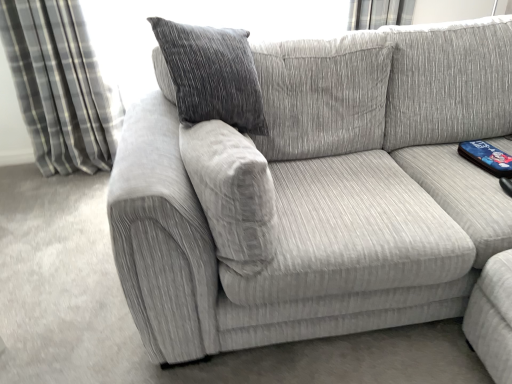
Question: Would you say gray plaid curtain at left contains textured fabric couch at center?

Choices:
 (A) yes
 (B) no

Answer: (B)

Question: Are gray plaid curtain at left and textured fabric couch at center located far from each other?

Choices:
 (A) yes
 (B) no

Answer: (A)

Question: Is gray plaid curtain at left in front of textured fabric couch at center?

Choices:
 (A) yes
 (B) no

Answer: (B)

Question: From the image's perspective, is gray plaid curtain at left located above textured fabric couch at center?

Choices:
 (A) no
 (B) yes

Answer: (B)

Question: Can you confirm if gray plaid curtain at left is taller than textured fabric couch at center?

Choices:
 (A) yes
 (B) no

Answer: (A)

Question: Does gray plaid curtain at left have a greater width compared to textured fabric couch at center?

Choices:
 (A) no
 (B) yes

Answer: (A)

Question: Would you say textured fabric couch at center is a long distance from gray plaid curtain at left?

Choices:
 (A) no
 (B) yes

Answer: (B)

Question: Is textured fabric couch at center bigger than gray plaid curtain at left?

Choices:
 (A) no
 (B) yes

Answer: (B)

Question: From a real-world perspective, is textured fabric couch at center positioned under gray plaid curtain at left based on gravity?

Choices:
 (A) yes
 (B) no

Answer: (A)

Question: Can you confirm if textured fabric couch at center is thinner than gray plaid curtain at left?

Choices:
 (A) yes
 (B) no

Answer: (B)

Question: Can you confirm if textured fabric couch at center is wider than gray plaid curtain at left?

Choices:
 (A) no
 (B) yes

Answer: (B)

Question: From a real-world perspective, is textured fabric couch at center located higher than gray plaid curtain at left?

Choices:
 (A) yes
 (B) no

Answer: (B)

Question: Visually, is gray plaid curtain at left positioned to the left or to the right of textured fabric couch at center?

Choices:
 (A) left
 (B) right

Answer: (A)